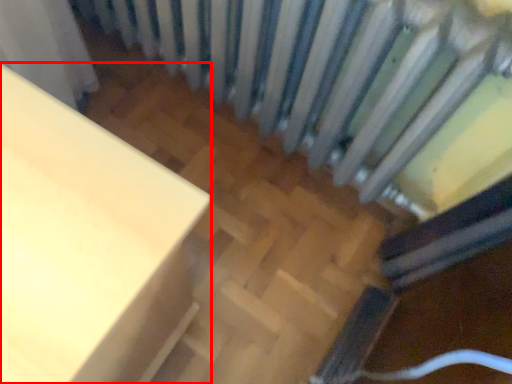
Question: Observing the image, what is the correct spatial positioning of furniture (annotated by the red box) in reference to radiator?

Choices:
 (A) left
 (B) right

Answer: (A)